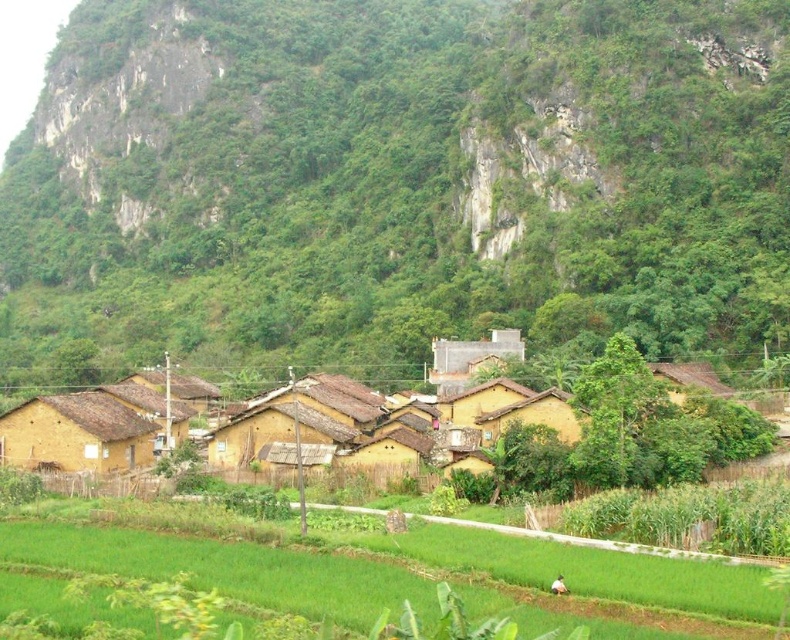
You are standing in the rural village and want to find the yellow clay houses at center. Which direction should you look to see them relative to the green grass at lower center?

The yellow clay houses at center are positioned over the green grass at lower center, so you should look upward from the green grass at lower center to see them.

You are standing in the rural village and want to walk to the base of the green rocky mountain at upper center. Which direction should you move relative to the yellow clay houses at center?

The green rocky mountain at upper center is further to the viewer than yellow clay houses at center, so you should move away from the yellow clay houses at center towards the mountain.

You are a visitor in this rural village and want to take a photo that includes both the yellow clay houses at center and the green grass at lower center. Which object should you focus on first to ensure both are in frame?

You should focus on the yellow clay houses at center first because they are larger in size than the green grass at lower center, so they will take up more space in the photo and need to be positioned carefully to include both.